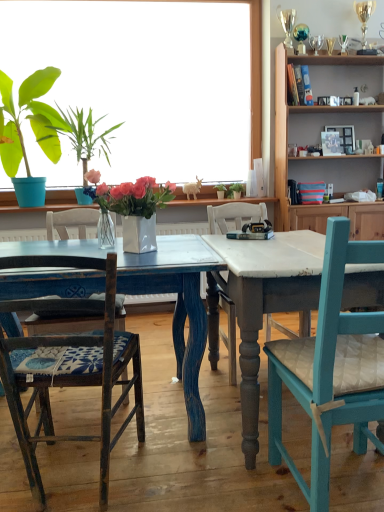
Question: Does wooden cabinet at upper right have a lesser height compared to distressed blue wood table at center?

Choices:
 (A) yes
 (B) no

Answer: (B)

Question: Is wooden cabinet at upper right smaller than distressed blue wood table at center?

Choices:
 (A) yes
 (B) no

Answer: (B)

Question: From a real-world perspective, is wooden cabinet at upper right located beneath distressed blue wood table at center?

Choices:
 (A) no
 (B) yes

Answer: (A)

Question: Considering the relative sizes of wooden cabinet at upper right and distressed blue wood table at center in the image provided, is wooden cabinet at upper right wider than distressed blue wood table at center?

Choices:
 (A) no
 (B) yes

Answer: (A)

Question: Is wooden cabinet at upper right far from distressed blue wood table at center?

Choices:
 (A) yes
 (B) no

Answer: (A)

Question: Is green matte plant pot at center, the 4th houseplant when ordered from left to right, taller or shorter than wooden cabinet at upper right?

Choices:
 (A) tall
 (B) short

Answer: (B)

Question: In terms of width, does green matte plant pot at center, which ranks as the second houseplant in back-to-front order, look wider or thinner when compared to wooden cabinet at upper right?

Choices:
 (A) thin
 (B) wide

Answer: (A)

Question: In the image, is green matte plant pot at center, which ranks as the second houseplant in right-to-left order, positioned in front of or behind wooden cabinet at upper right?

Choices:
 (A) behind
 (B) front

Answer: (A)

Question: Would you say green matte plant pot at center, which ranks as the second houseplant in back-to-front order, is inside or outside wooden cabinet at upper right?

Choices:
 (A) inside
 (B) outside

Answer: (B)

Question: Considering the relative positions of wooden cabinet at upper right and green leafy plant in blue pot at left, the 1th houseplant positioned from the left, in the image provided, is wooden cabinet at upper right to the left or to the right of green leafy plant in blue pot at left, the 1th houseplant positioned from the left,?

Choices:
 (A) right
 (B) left

Answer: (A)

Question: Considering the positions of wooden cabinet at upper right and green leafy plant in blue pot at left, the 1th houseplant positioned from the left, in the image, is wooden cabinet at upper right bigger or smaller than green leafy plant in blue pot at left, the 1th houseplant positioned from the left,?

Choices:
 (A) small
 (B) big

Answer: (B)

Question: From a real-world perspective, relative to green leafy plant in blue pot at left, which is the 5th houseplant from right to left, is wooden cabinet at upper right vertically above or below?

Choices:
 (A) above
 (B) below

Answer: (B)

Question: Would you say wooden cabinet at upper right is inside or outside green leafy plant in blue pot at left, which is the 5th houseplant from right to left?

Choices:
 (A) inside
 (B) outside

Answer: (B)

Question: From their relative heights in the image, would you say green leafy plant at center, the 5th houseplant from the front, is taller or shorter than green leafy plant at upper left, the 2th houseplant when ordered from left to right?

Choices:
 (A) tall
 (B) short

Answer: (B)

Question: Is green leafy plant at center, the 5th houseplant from the front, in front of or behind green leafy plant at upper left, the 2th houseplant when ordered from left to right, in the image?

Choices:
 (A) behind
 (B) front

Answer: (A)